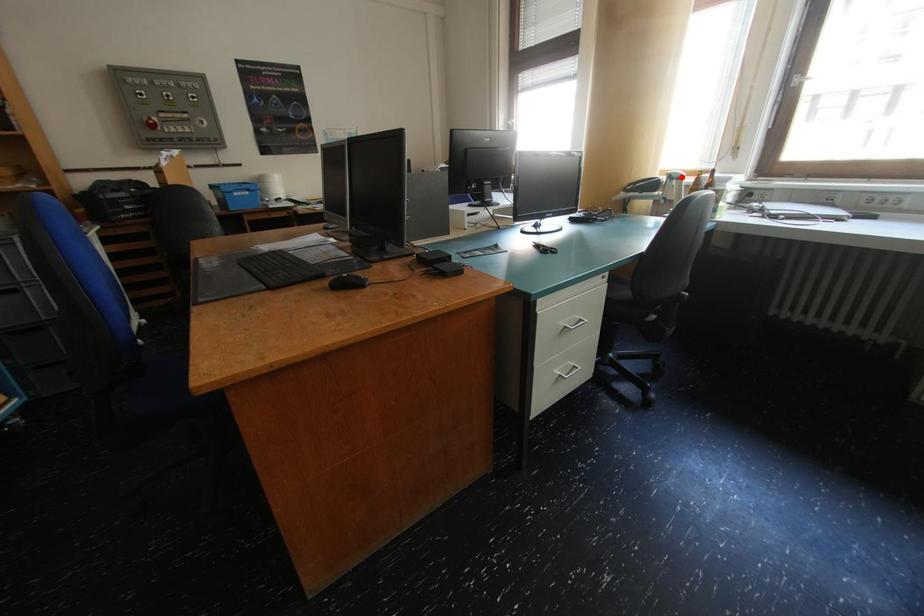
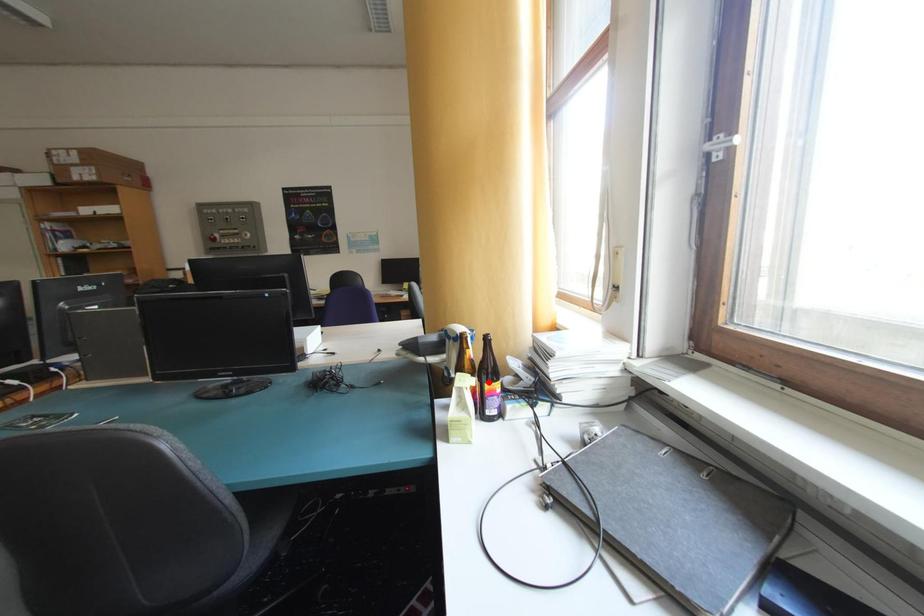
I am providing you with two images of the same scene from different viewpoints. A red point is marked on the first image and another point is marked on the second image. Do the highlighted points in image1 and image2 indicate the same real-world spot?

No